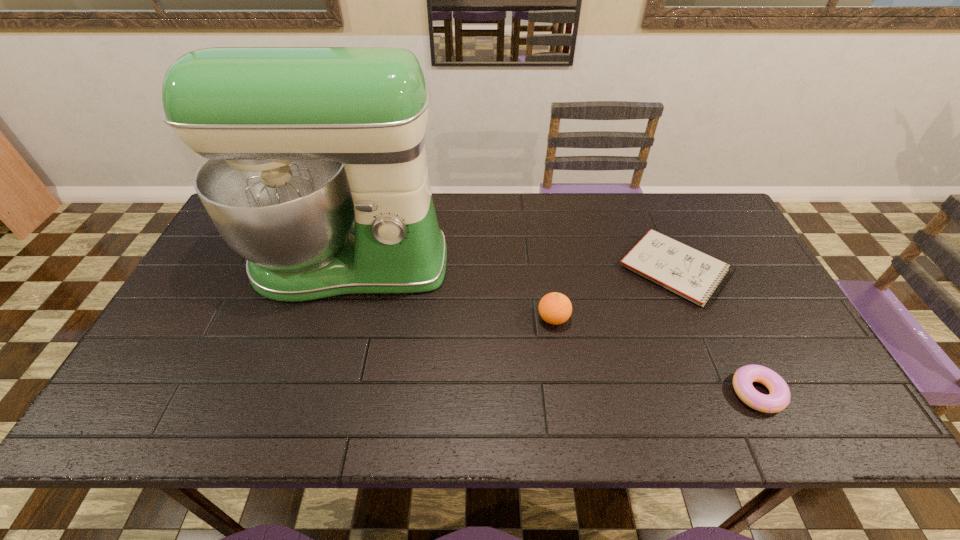
Where is `vacant region between the shortest object and the third tallest object`? This screenshot has width=960, height=540. vacant region between the shortest object and the third tallest object is located at coordinates (716, 331).

Locate an element on the screen. The height and width of the screenshot is (540, 960). free space between the third shortest object and the tallest object is located at coordinates (451, 291).

This screenshot has width=960, height=540. Find the location of `unoccupied area between the shortest object and the tallest object`. unoccupied area between the shortest object and the tallest object is located at coordinates (512, 266).

This screenshot has width=960, height=540. Identify the location of free space between the notepad and the leftmost object. pos(512,266).

Find the location of a particular element. Image resolution: width=960 pixels, height=540 pixels. object that is the closest to the notepad is located at coordinates (555, 308).

The image size is (960, 540). What are the coordinates of `object that is the closest to the nearest object` in the screenshot? It's located at (690, 273).

At what (x,y) coordinates should I click in order to perform the action: click on blank area in the image that satisfies the following two spatial constraints: 1. on the back side of the shortest object; 2. on the left side of the third shortest object. Please return your answer as a coordinate pair (x, y). Looking at the image, I should click on (546, 269).

Find the location of a particular element. vacant position in the image that satisfies the following two spatial constraints: 1. on the front side of the doughnut; 2. on the right side of the notepad is located at coordinates (729, 393).

Find the location of `free region that satisfies the following two spatial constraints: 1. on the controls of the shortest object; 2. on the left side of the tallest object`. free region that satisfies the following two spatial constraints: 1. on the controls of the shortest object; 2. on the left side of the tallest object is located at coordinates (347, 269).

Find the location of `free space that satisfies the following two spatial constraints: 1. on the controls of the second tallest object; 2. on the left side of the leftmost object`. free space that satisfies the following two spatial constraints: 1. on the controls of the second tallest object; 2. on the left side of the leftmost object is located at coordinates (332, 319).